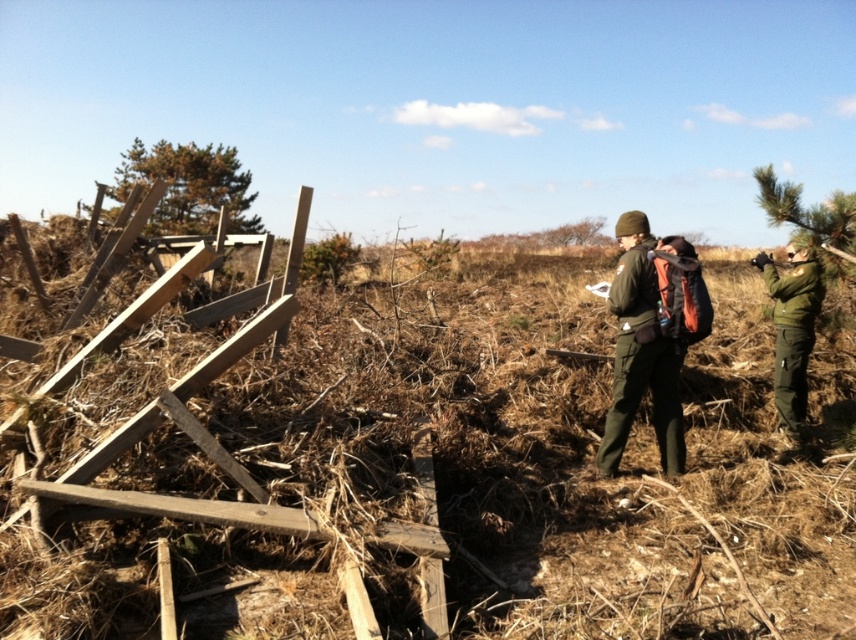
Between green matte jacket at right and green textured pine tree at upper right, which one appears on the right side from the viewer's perspective?

Positioned to the right is green textured pine tree at upper right.

The image size is (856, 640). I want to click on green matte jacket at right, so click(792, 330).

Does green matte uniform at center have a lesser width compared to green textured pine tree at upper right?

Yes, green matte uniform at center is thinner than green textured pine tree at upper right.

Measure the distance between green matte uniform at center and camera.

A distance of 14.97 feet exists between green matte uniform at center and camera.

Is point (614, 470) less distant than point (776, 192)?

That is True.

Find the location of a particular element. Image resolution: width=856 pixels, height=640 pixels. green matte uniform at center is located at coordinates (642, 353).

In the scene shown: Does green leafy tree at upper left appear on the right side of green textured pine tree at upper right?

No, green leafy tree at upper left is not to the right of green textured pine tree at upper right.

Can you confirm if green leafy tree at upper left is positioned above green textured pine tree at upper right?

Yes, green leafy tree at upper left is above green textured pine tree at upper right.

I want to click on green leafy tree at upper left, so click(189, 186).